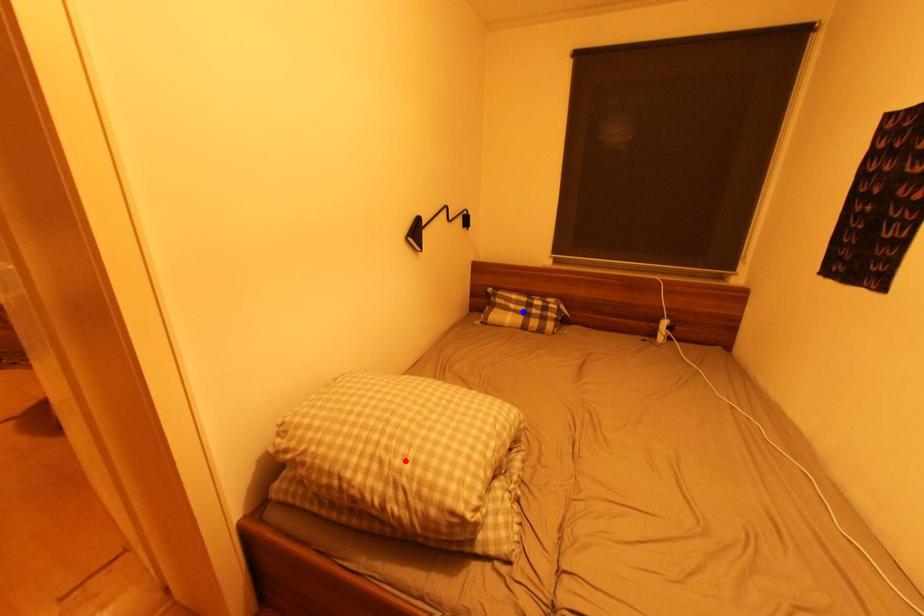
Question: In the image, two points are highlighted. Which point is nearer to the camera? Reply with the corresponding letter.

Choices:
 (A) blue point
 (B) red point

Answer: (B)